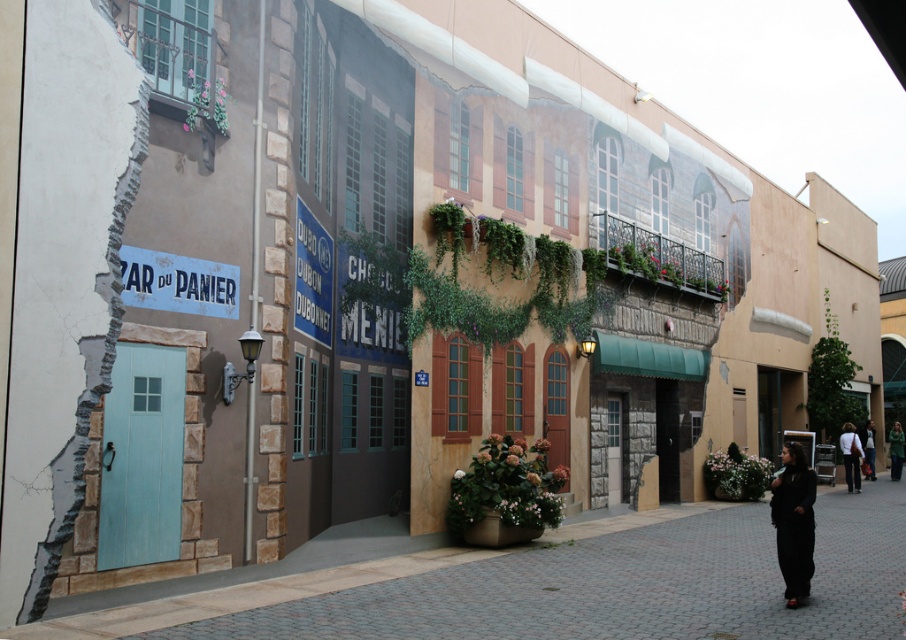
Does black matte dress at lower right have a lesser height compared to dark gray fabric jacket at lower right?

Correct, black matte dress at lower right is not as tall as dark gray fabric jacket at lower right.

Between black matte dress at lower right and dark gray fabric jacket at lower right, which one appears on the left side from the viewer's perspective?

black matte dress at lower right is more to the left.

Where is `black matte dress at lower right`? The width and height of the screenshot is (906, 640). black matte dress at lower right is located at coordinates (794, 522).

Is point (860, 593) closer to viewer compared to point (849, 486)?

Yes, point (860, 593) is in front of point (849, 486).

Does point (686, 604) lie behind point (850, 429)?

No, (686, 604) is closer to viewer.

Between point (718, 512) and point (843, 444), which one is positioned behind?

The point (843, 444) is behind.

At what (x,y) coordinates should I click in order to perform the action: click on paved stone walkway at lower center. Please return your answer as a coordinate pair (x, y). Looking at the image, I should click on (567, 584).

Does point (847, 429) come behind point (863, 433)?

That is False.

Does point (855, 456) lie behind point (866, 445)?

No, (855, 456) is in front of (866, 445).

In order to click on dark gray fabric jacket at lower right in this screenshot , I will do `click(850, 456)`.